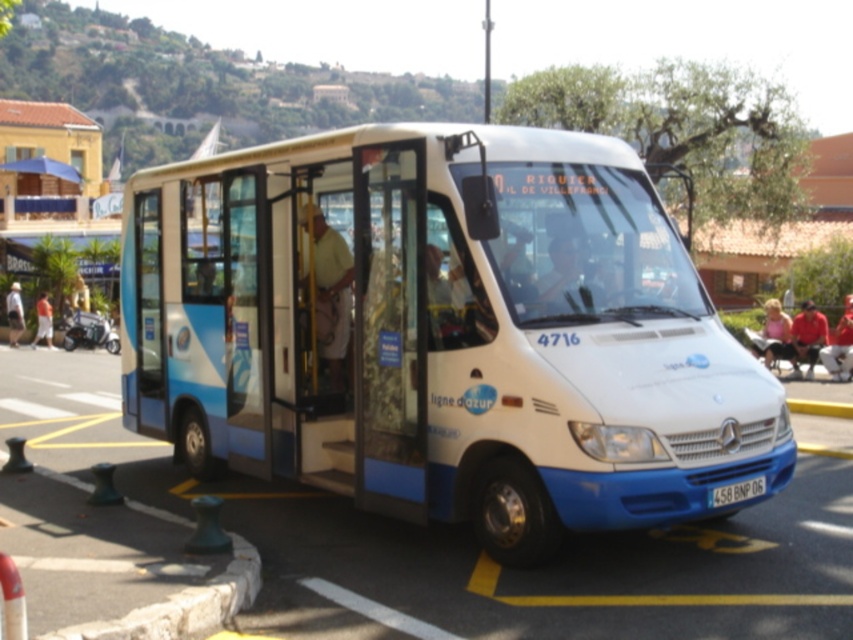
Does red fabric pants at lower right have a greater width compared to orange shirt at left?

Incorrect, red fabric pants at lower right's width does not surpass orange shirt at left's.

Between point (845, 356) and point (44, 323), which one is positioned behind?

Point (44, 323)

You are a GUI agent. You are given a task and a screenshot of the screen. Output one action in this format:
    pyautogui.click(x=<x>, y=<y>)
    Task: Click on the red fabric pants at lower right
    This screenshot has width=853, height=640.
    Given the screenshot: What is the action you would take?
    pyautogui.click(x=840, y=346)

How much distance is there between pink fabric at lower right and white plastic license plate at center?

The distance of pink fabric at lower right from white plastic license plate at center is 10.81 meters.

Can you confirm if pink fabric at lower right is smaller than white plastic license plate at center?

Yes, pink fabric at lower right is smaller than white plastic license plate at center.

What do you see at coordinates (770, 332) in the screenshot? I see `pink fabric at lower right` at bounding box center [770, 332].

Where is `pink fabric at lower right`? pink fabric at lower right is located at coordinates (770, 332).

Which of these two, green concrete curb at lower left or orange shirt at left, stands taller?

orange shirt at left

Does point (82, 628) come in front of point (35, 333)?

Yes, point (82, 628) is closer to viewer.

Between point (161, 515) and point (42, 314), which one is positioned in front?

Positioned in front is point (161, 515).

Locate an element on the screen. green concrete curb at lower left is located at coordinates (114, 564).